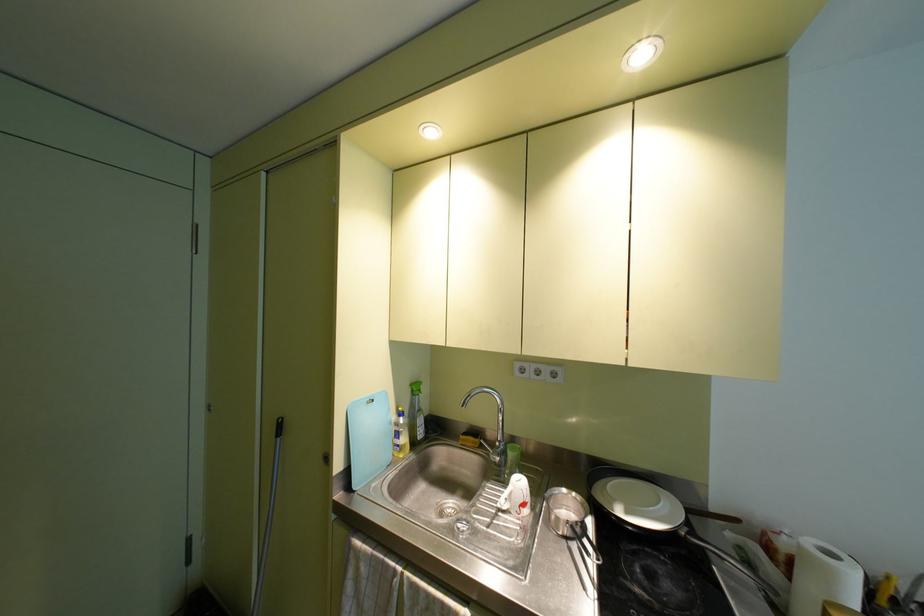
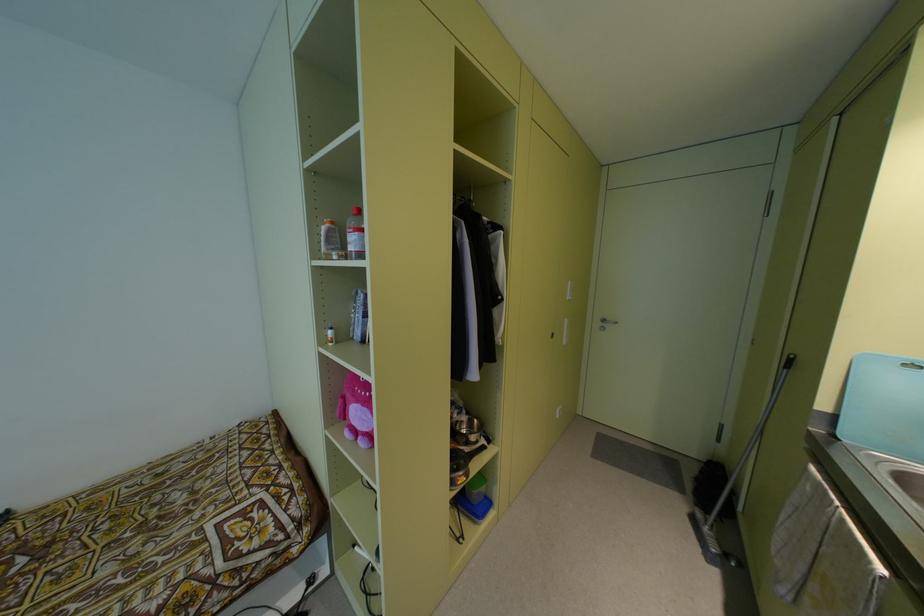
Question: How did the camera likely rotate?

Choices:
 (A) Left
 (B) Right
 (C) Up
 (D) Down

Answer: (A)